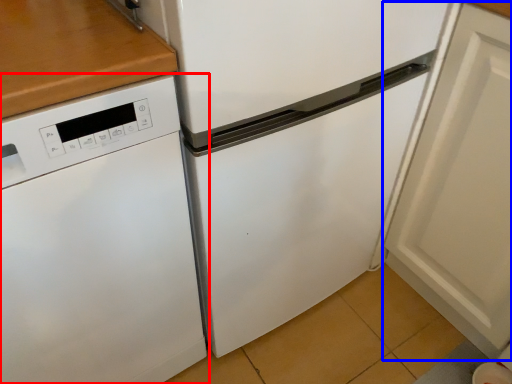
Question: Which object appears closest to the camera in this image, home appliance (highlighted by a red box) or door (highlighted by a blue box)?

Choices:
 (A) home appliance
 (B) door

Answer: (A)